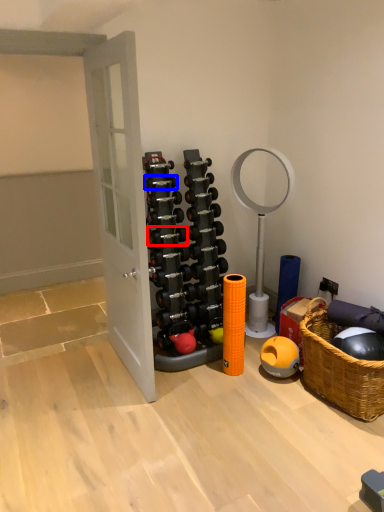
Question: Among these objects, which one is nearest to the camera, dumbbell (highlighted by a red box) or dumbbell (highlighted by a blue box)?

Choices:
 (A) dumbbell
 (B) dumbbell

Answer: (B)